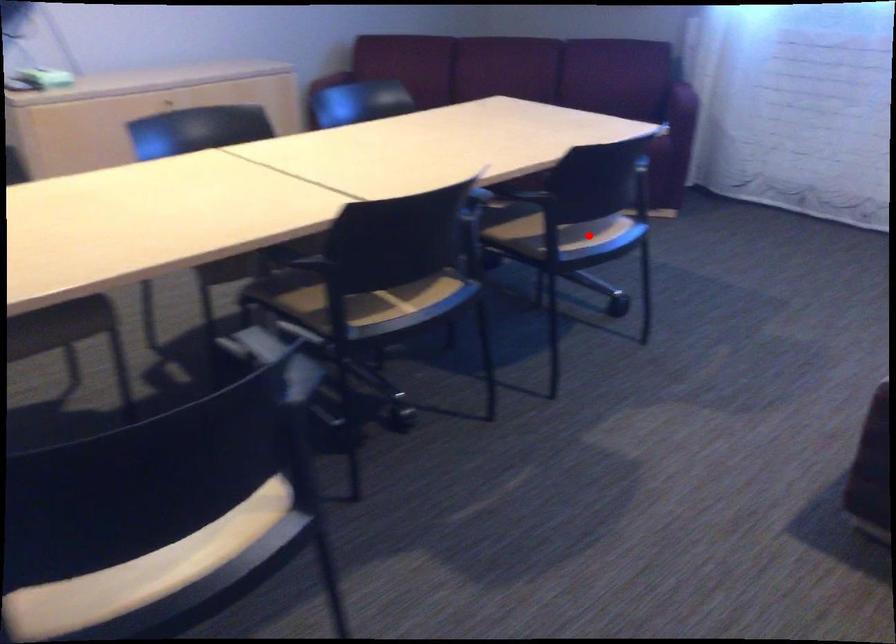
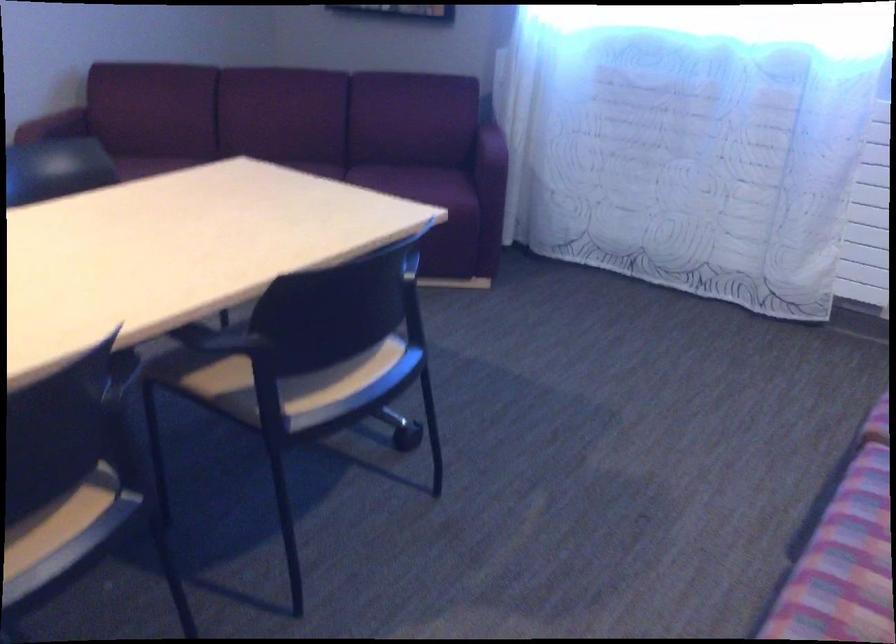
Question: I am providing you with two images of the same scene from different viewpoints. In image1, a red point is highlighted. Considering the same 3D point in image2, which of the following is correct?

Choices:
 (A) It is closer
 (B) It is farther

Answer: (A)